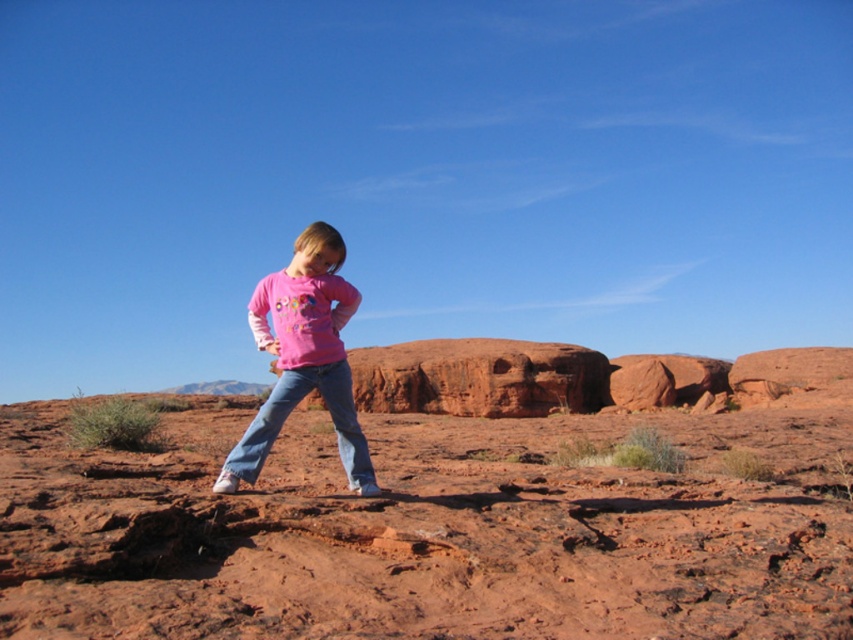
Question: Is smooth sand at center closer to the viewer compared to denim jeans at center?

Choices:
 (A) yes
 (B) no

Answer: (A)

Question: Which of these objects is positioned farthest from the pink cotton shirt at center?

Choices:
 (A) denim jeans at center
 (B) smooth sand at center

Answer: (B)

Question: Is smooth sand at center to the right of denim jeans at center from the viewer's perspective?

Choices:
 (A) yes
 (B) no

Answer: (A)

Question: Which of the following is the closest to the observer?

Choices:
 (A) (341, 460)
 (B) (570, 499)
 (C) (329, 380)

Answer: (C)

Question: Does pink cotton shirt at center appear under denim jeans at center?

Choices:
 (A) yes
 (B) no

Answer: (A)

Question: Which object is closer to the camera taking this photo?

Choices:
 (A) smooth sand at center
 (B) denim jeans at center

Answer: (A)